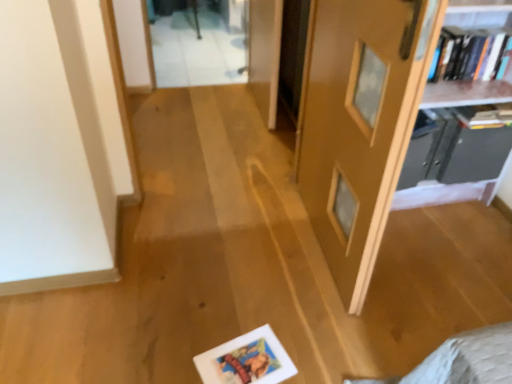
Where is `vacant area that is situated to the right of matte wooden door at center`? The height and width of the screenshot is (384, 512). vacant area that is situated to the right of matte wooden door at center is located at coordinates (439, 263).